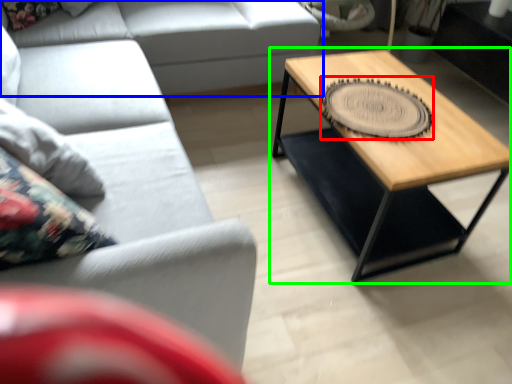
Question: Considering the real-world distances, which object is farthest from coaster (highlighted by a red box)? studio couch (highlighted by a blue box) or coffee table (highlighted by a green box)?

Choices:
 (A) studio couch
 (B) coffee table

Answer: (A)